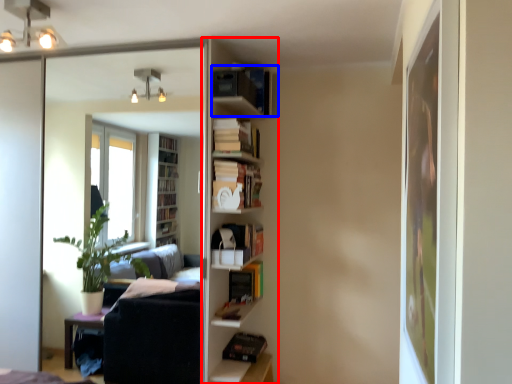
Question: Which object appears closest to the camera in this image, shelf (highlighted by a red box) or book (highlighted by a blue box)?

Choices:
 (A) shelf
 (B) book

Answer: (B)